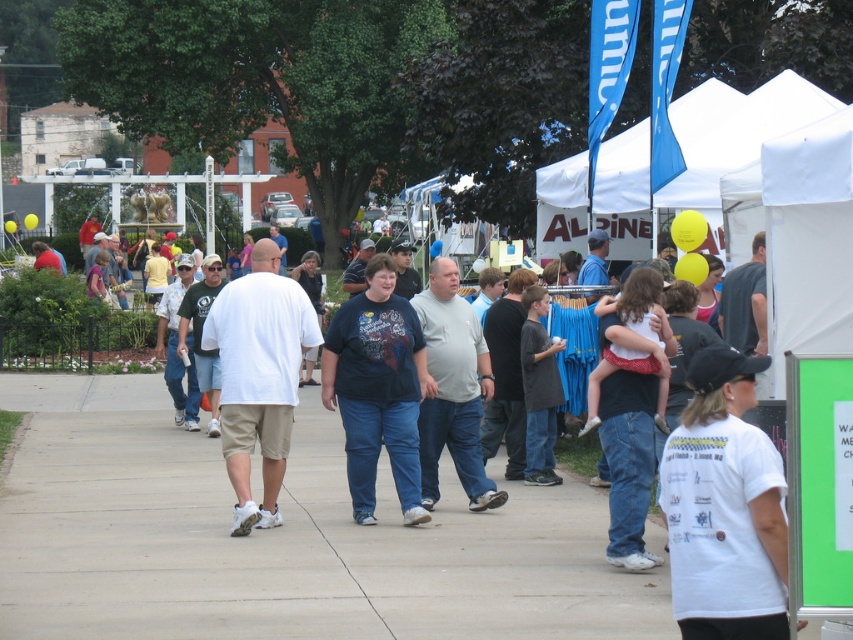
You are standing at the point marked by the coordinates point [724,508]. Looking around, you see a white t shirt at lower right. What is the nearest object to your current position?

The nearest object to your current position marked by point [724,508] is the white t shirt at lower right since it is directly indicated by the point.